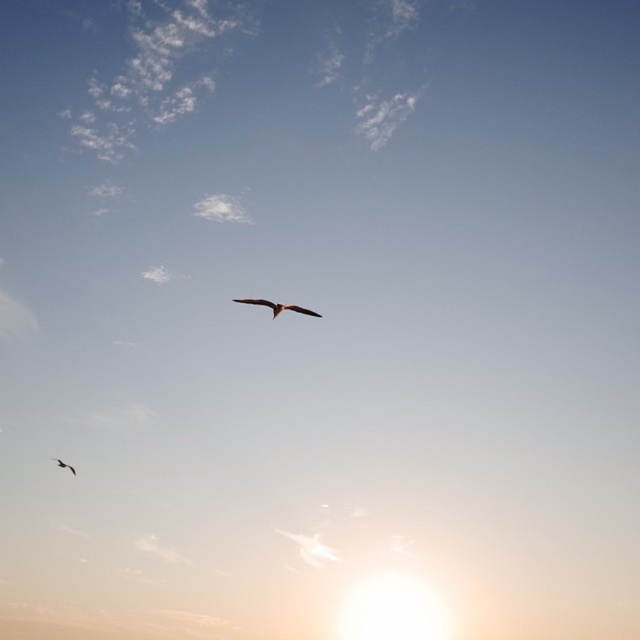
You are observing the two birds in the sky. Which bird is closer to you, the one at point (278, 307) or the one at point (58, 458)?

The bird at point (278, 307) is closer to you than the bird at point (58, 458).

You are an astronomer observing the sky and notice the brown feathered bird at center. If you were to draw a straight line from the sun to the bird, would this line pass through the center of the image?

The brown feathered bird at center is located at coordinates (276, 307). Since the sun is positioned low near the horizon, the line drawn from the sun to the bird would not pass through the exact center of the image unless the bird is directly along that path. However, without knowing the suns exact coordinates, we can infer that the bird is near the center but not necessarily aligned with the suns position. Therefore, the line might not pass through the center of the image.

You are an ornithologist observing the birds in the sky. You notice two birds, a brown feathered bird at center and a silhouette feathered bird at lower left. Which bird has a greater wingspan?

The brown feathered bird at center has a greater wingspan since its width is larger than the silhouette feathered bird at lower left.